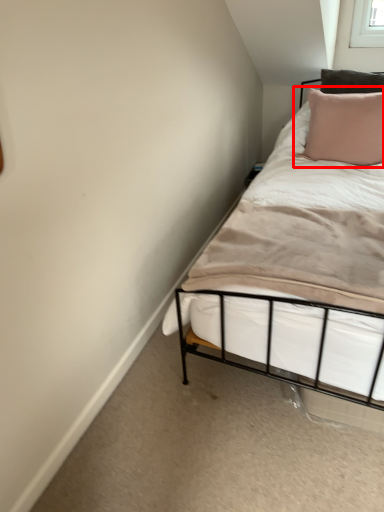
Question: Considering the relative positions of pillow (annotated by the red box) and mattress in the image provided, where is pillow (annotated by the red box) located with respect to the staircase?

Choices:
 (A) left
 (B) right

Answer: (B)